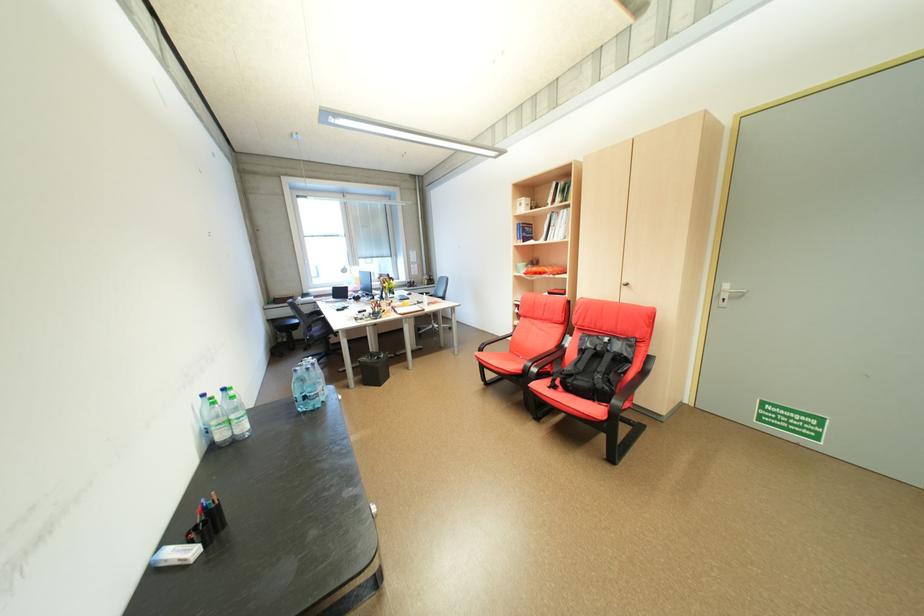
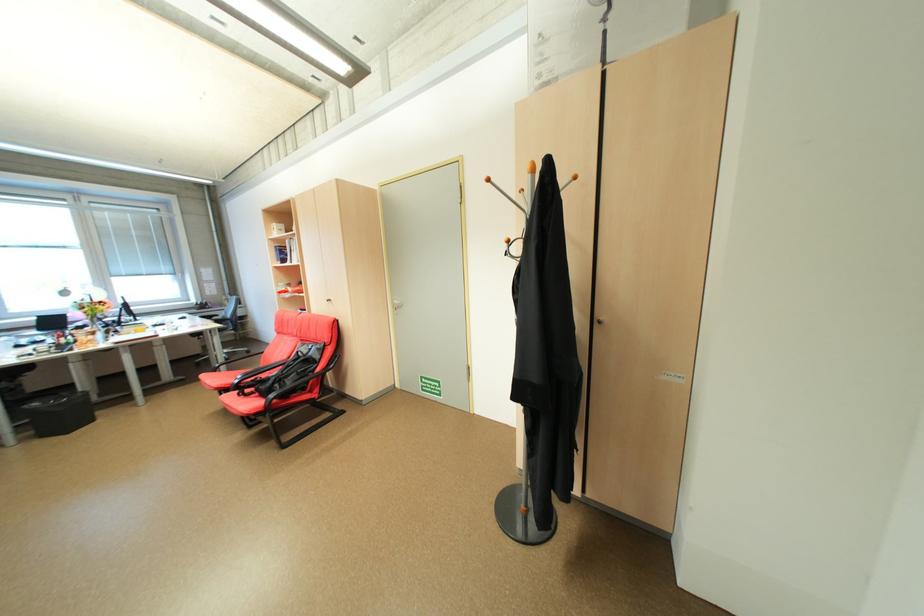
In a continuous first-person perspective shot, in which direction is the camera moving?

The cameraman moved toward right, backward.